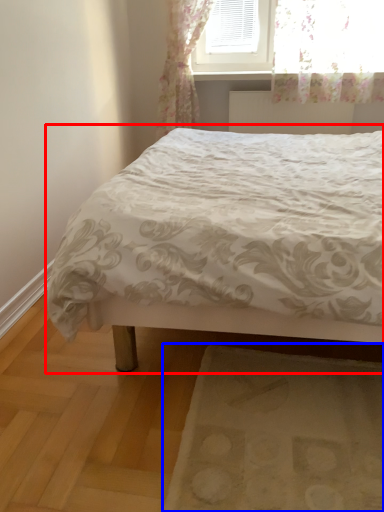
Question: Which of the following is the farthest to the observer, bed (highlighted by a red box) or mat (highlighted by a blue box)?

Choices:
 (A) bed
 (B) mat

Answer: (B)